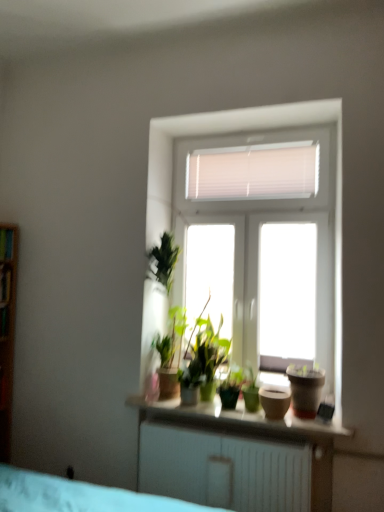
Question: Is transparent glass window at upper center to the left of matte brown pot at center, arranged as the second flowerpot when viewed from the right, from the viewer's perspective?

Choices:
 (A) yes
 (B) no

Answer: (A)

Question: From a real-world perspective, is transparent glass window at upper center beneath matte brown pot at center, which is counted as the first flowerpot, starting from the left?

Choices:
 (A) yes
 (B) no

Answer: (B)

Question: Is transparent glass window at upper center directly adjacent to matte brown pot at center, arranged as the second flowerpot when viewed from the right?

Choices:
 (A) yes
 (B) no

Answer: (B)

Question: From the image's perspective, would you say transparent glass window at upper center is shown under matte brown pot at center, arranged as the second flowerpot when viewed from the right?

Choices:
 (A) yes
 (B) no

Answer: (B)

Question: Considering the relative sizes of transparent glass window at upper center and matte brown pot at center, which is counted as the first flowerpot, starting from the left, in the image provided, is transparent glass window at upper center bigger than matte brown pot at center, which is counted as the first flowerpot, starting from the left,?

Choices:
 (A) yes
 (B) no

Answer: (A)

Question: Is transparent glass window at upper center turned away from matte brown pot at center, which is counted as the first flowerpot, starting from the left?

Choices:
 (A) yes
 (B) no

Answer: (B)

Question: From a real-world perspective, is wooden shelf at left, arranged as the second shelf when ordered from the bottom, under green matte houseplant at center?

Choices:
 (A) yes
 (B) no

Answer: (B)

Question: Can green matte houseplant at center be found inside wooden shelf at left, arranged as the second shelf when ordered from the bottom?

Choices:
 (A) no
 (B) yes

Answer: (A)

Question: From the image's perspective, would you say wooden shelf at left, placed as the first shelf when sorted from top to bottom, is shown under green matte houseplant at center?

Choices:
 (A) no
 (B) yes

Answer: (A)

Question: Can you confirm if wooden shelf at left, arranged as the second shelf when ordered from the bottom, is wider than green matte houseplant at center?

Choices:
 (A) no
 (B) yes

Answer: (A)

Question: Is wooden shelf at left, placed as the first shelf when sorted from top to bottom, next to green matte houseplant at center?

Choices:
 (A) yes
 (B) no

Answer: (B)

Question: From the image's perspective, is wooden shelf at left, arranged as the second shelf when ordered from the bottom, on green matte houseplant at center?

Choices:
 (A) yes
 (B) no

Answer: (A)

Question: Considering the relative positions of matte brown pot at right, which is counted as the second flowerpot, starting from the left, and wooden shelf at left, which is the 2th shelf in top-to-bottom order, in the image provided, is matte brown pot at right, which is counted as the second flowerpot, starting from the left, to the right of wooden shelf at left, which is the 2th shelf in top-to-bottom order, from the viewer's perspective?

Choices:
 (A) yes
 (B) no

Answer: (A)